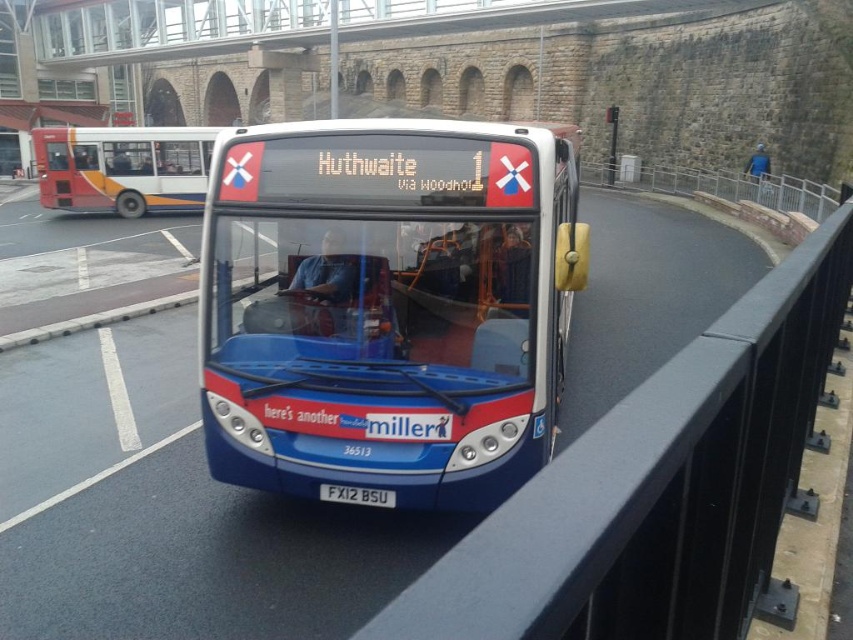
Question: Which object appears farthest from the camera in this image?

Choices:
 (A) blue metallic bus at center
 (B) matte red bus at left
 (C) white metallic license plate at center

Answer: (B)

Question: Which of the following is the closest to the observer?

Choices:
 (A) (387, 504)
 (B) (68, 145)
 (C) (659, 404)
 (D) (456, 426)

Answer: (C)

Question: Which point is closer to the camera?

Choices:
 (A) (347, 497)
 (B) (250, 428)
 (C) (183, 198)

Answer: (A)

Question: Where is blue metallic bus at center located in relation to matte red bus at left in the image?

Choices:
 (A) left
 (B) right

Answer: (B)

Question: Is metal at center bigger than white metallic license plate at center?

Choices:
 (A) no
 (B) yes

Answer: (B)

Question: Can you confirm if metal at center is smaller than matte red bus at left?

Choices:
 (A) yes
 (B) no

Answer: (A)